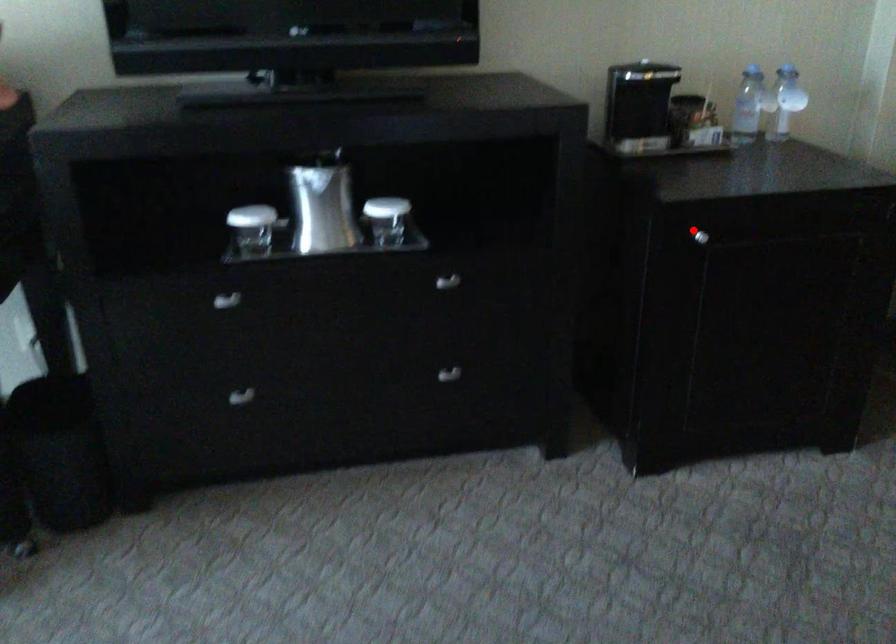
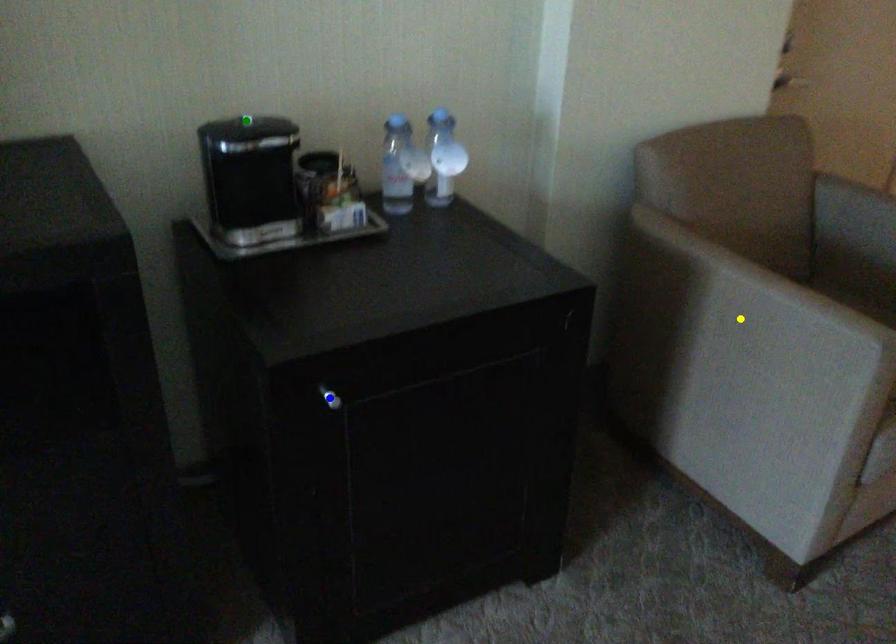
Question: I am providing you with two images of the same scene from different viewpoints. A red point is marked on the first image. You are given multiple points on the second image. Which spot in image 2 lines up with the point in image 1?

Choices:
 (A) blue point
 (B) yellow point
 (C) green point

Answer: (A)